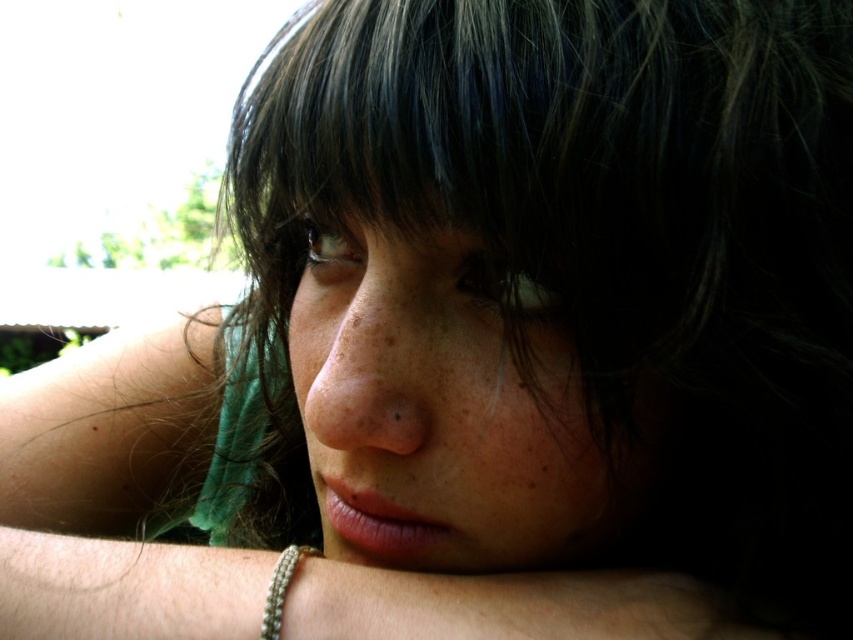
Between smooth skin face at center and smooth silver bracelet at lower center, which one is positioned higher?

Positioned higher is smooth skin face at center.

I want to click on smooth skin face at center, so click(438, 397).

Looking at this image, is smooth silver bracelet at lower center smaller than silver metallic bracelet at lower left?

Incorrect, smooth silver bracelet at lower center is not smaller in size than silver metallic bracelet at lower left.

Does point (334, 572) lie in front of point (279, 628)?

No, it is behind (279, 628).

Identify the location of smooth silver bracelet at lower center. Image resolution: width=853 pixels, height=640 pixels. (494, 605).

Is point (364, 227) closer to viewer compared to point (280, 602)?

That is False.

Between smooth skin face at center and silver metallic bracelet at lower left, which one is positioned higher?

smooth skin face at center is above.

Is point (442, 499) less distant than point (285, 596)?

No, it is not.

Find the location of a particular element. This screenshot has width=853, height=640. smooth skin face at center is located at coordinates (438, 397).